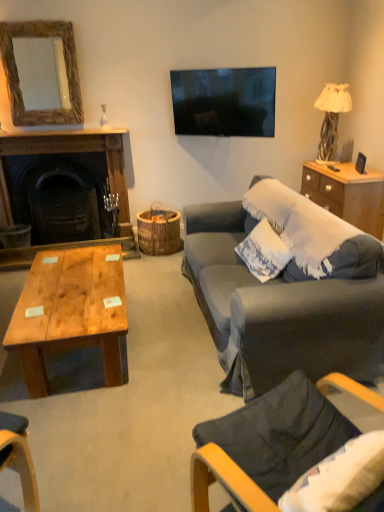
This screenshot has height=512, width=384. What are the coordinates of `vacant area that is in front of wooden coffee table at center` in the screenshot? It's located at (103, 433).